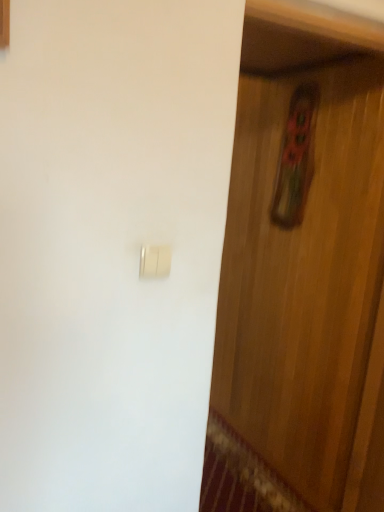
Question: Would you say gold metallic light switch at center is outside wooden door at center?

Choices:
 (A) yes
 (B) no

Answer: (A)

Question: From a real-world perspective, is gold metallic light switch at center on top of wooden door at center?

Choices:
 (A) no
 (B) yes

Answer: (B)

Question: Is gold metallic light switch at center oriented away from wooden door at center?

Choices:
 (A) no
 (B) yes

Answer: (A)

Question: Does gold metallic light switch at center appear on the right side of wooden door at center?

Choices:
 (A) yes
 (B) no

Answer: (B)

Question: Is the position of gold metallic light switch at center less distant than that of wooden door at center?

Choices:
 (A) yes
 (B) no

Answer: (A)

Question: From the image's perspective, is gold metallic light switch at center located above wooden door at center?

Choices:
 (A) yes
 (B) no

Answer: (A)

Question: Is wooden door at center surrounding gold metallic light switch at center?

Choices:
 (A) yes
 (B) no

Answer: (B)

Question: From the image's perspective, would you say wooden door at center is positioned over gold metallic light switch at center?

Choices:
 (A) no
 (B) yes

Answer: (A)

Question: Can you confirm if wooden door at center is taller than gold metallic light switch at center?

Choices:
 (A) no
 (B) yes

Answer: (B)

Question: Is wooden door at center closer to camera compared to gold metallic light switch at center?

Choices:
 (A) yes
 (B) no

Answer: (B)

Question: Does wooden door at center touch gold metallic light switch at center?

Choices:
 (A) yes
 (B) no

Answer: (B)

Question: Considering the relative sizes of wooden door at center and gold metallic light switch at center in the image provided, is wooden door at center wider than gold metallic light switch at center?

Choices:
 (A) no
 (B) yes

Answer: (B)

Question: Considering the positions of point (145, 266) and point (279, 156), is point (145, 266) closer or farther from the camera than point (279, 156)?

Choices:
 (A) farther
 (B) closer

Answer: (B)